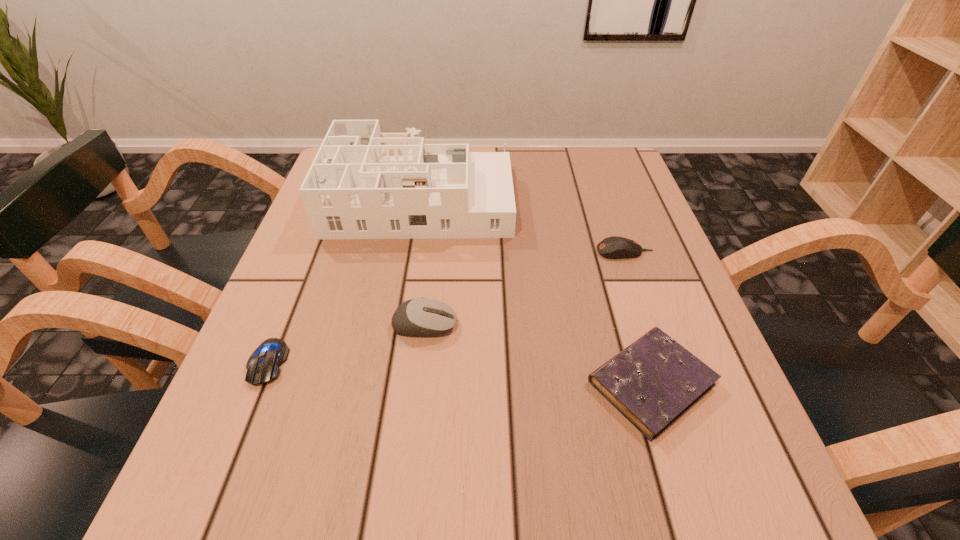
You are a GUI agent. You are given a task and a screenshot of the screen. Output one action in this format:
    pyautogui.click(x=<x>, y=<y>)
    Task: Click on the unoccupied area between the diary and the tallest object
    This screenshot has height=540, width=960.
    Given the screenshot: What is the action you would take?
    click(x=536, y=290)

The width and height of the screenshot is (960, 540). I want to click on free spot between the fourth shortest object and the third tallest object, so click(524, 288).

Find the location of a particular element. The height and width of the screenshot is (540, 960). vacant point located between the shortest computer mouse and the tallest object is located at coordinates (344, 280).

This screenshot has height=540, width=960. In order to click on vacant space that's between the dollhouse and the tallest computer mouse in this screenshot , I will do `click(422, 261)`.

This screenshot has height=540, width=960. Find the location of `free spot between the shortest computer mouse and the dollhouse`. free spot between the shortest computer mouse and the dollhouse is located at coordinates (344, 280).

Choose which object is the fourth nearest neighbor to the dollhouse. Please provide its 2D coordinates. Your answer should be formatted as a tuple, i.e. [(x, y)], where the tuple contains the x and y coordinates of a point satisfying the conditions above.

[(652, 382)]

Find the location of a particular element. This screenshot has width=960, height=540. object that can be found as the fourth closest to the tallest computer mouse is located at coordinates (614, 247).

Where is `computer mouse object that ranks as the second closest to the farthest computer mouse`? This screenshot has width=960, height=540. computer mouse object that ranks as the second closest to the farthest computer mouse is located at coordinates (263, 365).

This screenshot has height=540, width=960. In order to click on computer mouse that is the second closest to the farthest computer mouse in this screenshot , I will do `click(263, 365)`.

Identify the location of vacant area that satisfies the following two spatial constraints: 1. on the button side of the diary; 2. on the left side of the leftmost computer mouse. The image size is (960, 540). (259, 383).